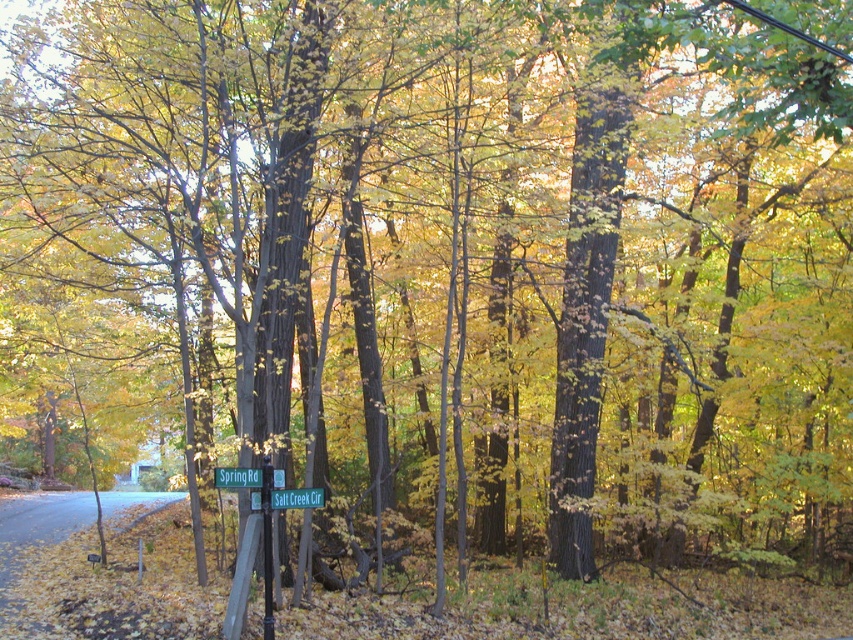
Question: Which object is positioned farthest from the green plastic sign at center?

Choices:
 (A) green plastic street sign at center
 (B) metallic signpost at center

Answer: (B)

Question: Which object appears closest to the camera in this image?

Choices:
 (A) green plastic street sign at center
 (B) metallic signpost at center
 (C) green plastic sign at center

Answer: (C)

Question: Can you confirm if green plastic street sign at center is positioned above green plastic sign at center?

Choices:
 (A) yes
 (B) no

Answer: (B)

Question: Can you confirm if green plastic street sign at center is positioned below green plastic sign at center?

Choices:
 (A) no
 (B) yes

Answer: (B)

Question: Does metallic signpost at center come behind green plastic sign at center?

Choices:
 (A) no
 (B) yes

Answer: (B)

Question: Based on their relative distances, which object is farther from the green plastic sign at center?

Choices:
 (A) metallic signpost at center
 (B) green plastic street sign at center

Answer: (A)